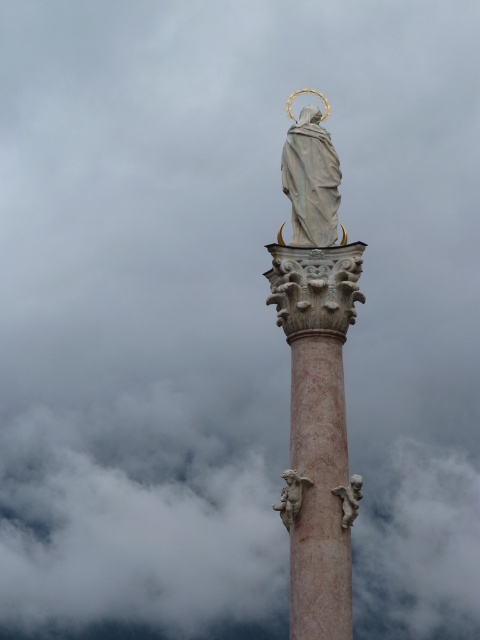
Does white fluffy clouds at center appear on the right side of smooth white statue at center?

Incorrect, white fluffy clouds at center is not on the right side of smooth white statue at center.

Which of these two, white fluffy clouds at center or smooth white statue at center, stands taller?

white fluffy clouds at center

Who is more forward, (440, 445) or (325, 186)?

Positioned in front is point (325, 186).

You are a GUI agent. You are given a task and a screenshot of the screen. Output one action in this format:
    pyautogui.click(x=<x>, y=<y>)
    Task: Click on the white fluffy clouds at center
    
    Given the screenshot: What is the action you would take?
    pyautogui.click(x=145, y=515)

Does smooth white statue at center have a lesser width compared to matte stone cherub at lower center?

Incorrect, smooth white statue at center's width is not less than matte stone cherub at lower center's.

Is smooth white statue at center wider than matte stone cherub at lower center?

Correct, the width of smooth white statue at center exceeds that of matte stone cherub at lower center.

Does point (310, 189) lie behind point (305, 477)?

Yes, point (310, 189) is farther from viewer.

At what (x,y) coordinates should I click in order to perform the action: click on smooth white statue at center. Please return your answer as a coordinate pair (x, y). Looking at the image, I should click on (311, 176).

Does pink marble cherub at center have a greater width compared to smooth white statue at center?

No.

What do you see at coordinates (319, 490) in the screenshot? Image resolution: width=480 pixels, height=640 pixels. I see `pink marble cherub at center` at bounding box center [319, 490].

Is point (311, 353) farther from camera compared to point (299, 160)?

That is False.

Where is `pink marble cherub at center`? The height and width of the screenshot is (640, 480). pink marble cherub at center is located at coordinates (319, 490).